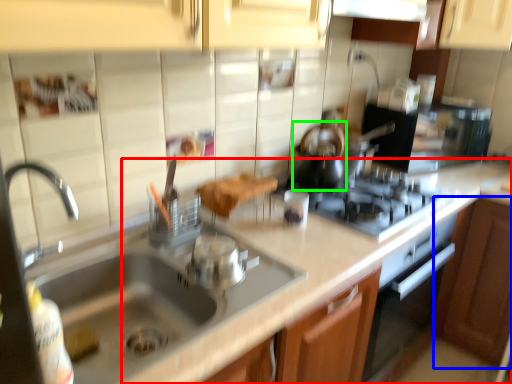
Question: Which object is the closest to the counter top (highlighted by a red box)? Choose among these: cabinetry (highlighted by a blue box) or tea pot (highlighted by a green box).

Choices:
 (A) cabinetry
 (B) tea pot

Answer: (B)